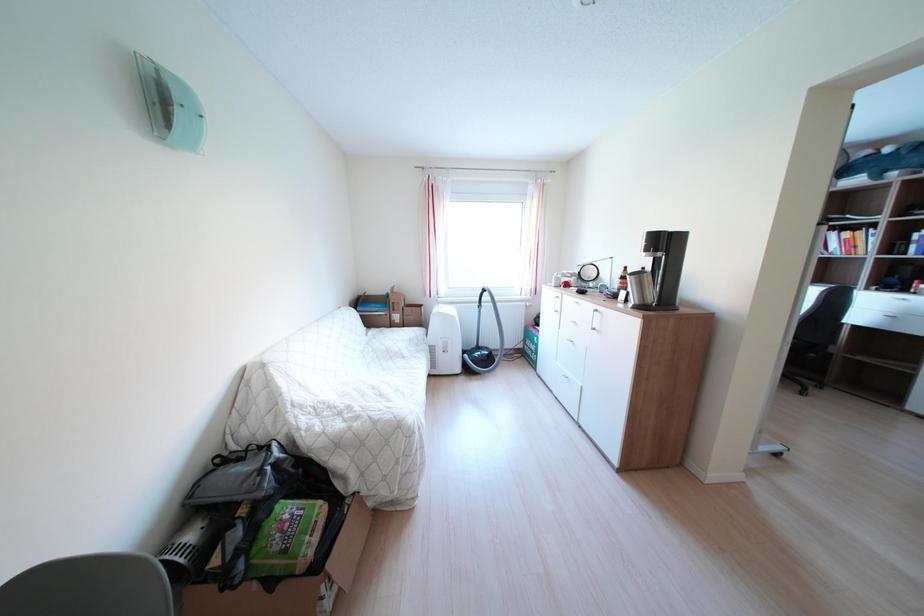
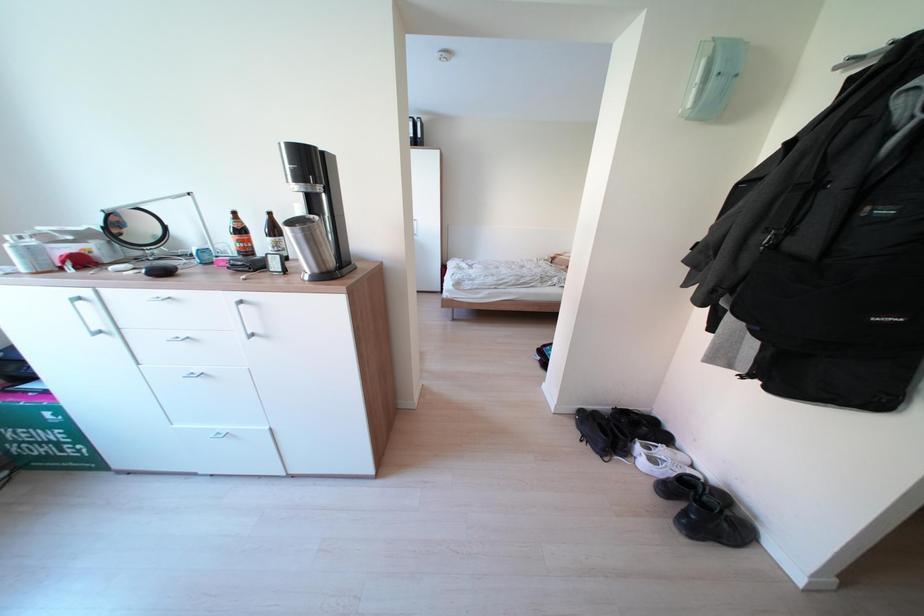
The images are taken continuously from a first-person perspective. In which direction is your viewpoint rotating?

The camera rotated toward right-down.